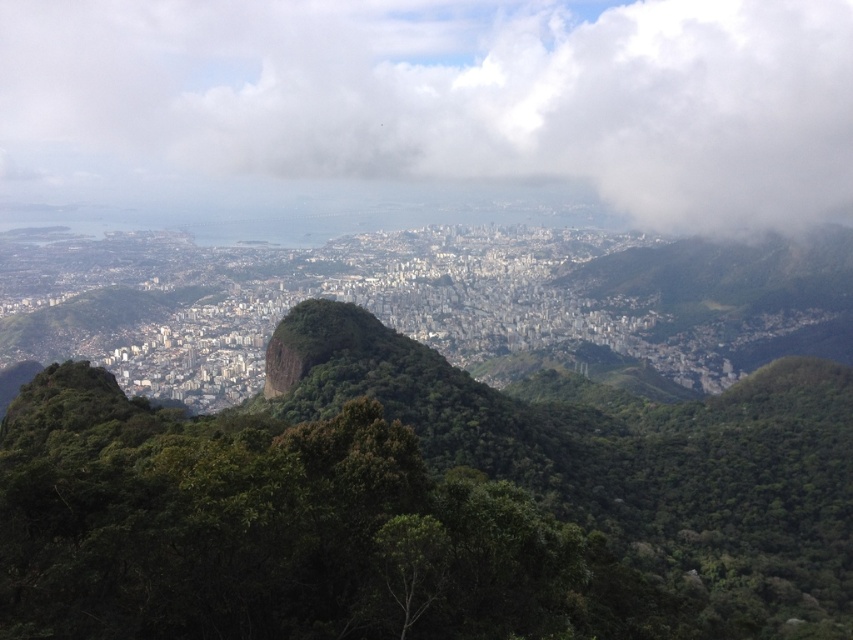
Who is taller, white fluffy cloud at upper center or green rough rock at center?

white fluffy cloud at upper center is taller.

What do you see at coordinates (434, 102) in the screenshot? I see `white fluffy cloud at upper center` at bounding box center [434, 102].

Who is more distant from viewer, (x=350, y=193) or (x=281, y=385)?

Positioned behind is point (x=350, y=193).

This screenshot has width=853, height=640. Find the location of `white fluffy cloud at upper center`. white fluffy cloud at upper center is located at coordinates (434, 102).